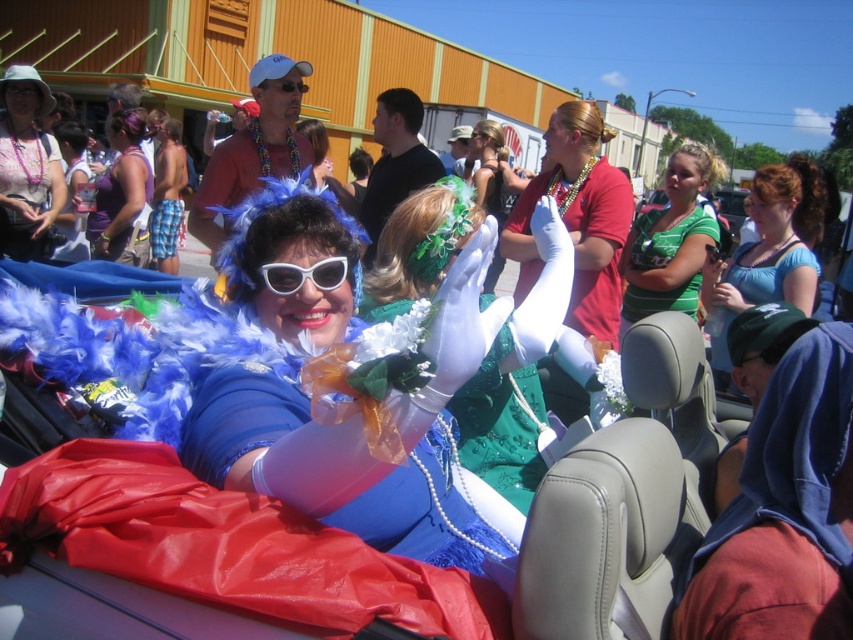
Question: Is green jersey at center thinner than matte white sunglasses at upper center?

Choices:
 (A) yes
 (B) no

Answer: (B)

Question: Which point appears closest to the camera in this image?

Choices:
 (A) (325, 275)
 (B) (694, 193)

Answer: (A)

Question: Does shiny green dress at center come behind matte white sunglasses at upper center?

Choices:
 (A) yes
 (B) no

Answer: (B)

Question: Which point is farther to the camera?

Choices:
 (A) matte blue feather boa at center
 (B) purple fabric dress at center
 (C) white plastic sunglasses at center
 (D) green satin dress at center

Answer: (D)

Question: Does shiny green dress at center have a smaller size compared to green jersey at center?

Choices:
 (A) yes
 (B) no

Answer: (A)

Question: Which object is positioned farthest from the matte blue feather boa at center?

Choices:
 (A) blue feather boa at upper center
 (B) matte green dress at center
 (C) green satin dress at center

Answer: (C)